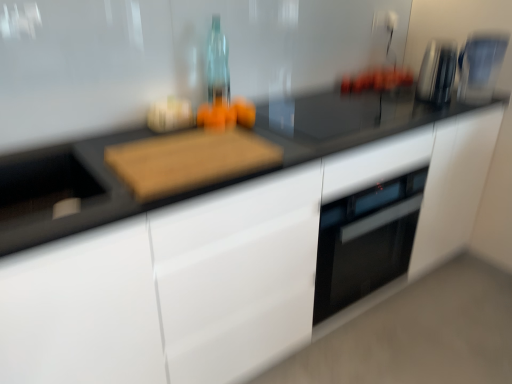
Question: Considering the relative sizes of orange matte oranges at center and satin silver toaster at upper right in the image provided, is orange matte oranges at center bigger than satin silver toaster at upper right?

Choices:
 (A) yes
 (B) no

Answer: (B)

Question: From a real-world perspective, is orange matte oranges at center beneath satin silver toaster at upper right?

Choices:
 (A) no
 (B) yes

Answer: (B)

Question: Is orange matte oranges at center thinner than satin silver toaster at upper right?

Choices:
 (A) yes
 (B) no

Answer: (A)

Question: Is the depth of orange matte oranges at center less than that of satin silver toaster at upper right?

Choices:
 (A) yes
 (B) no

Answer: (A)

Question: Does orange matte oranges at center have a greater height compared to satin silver toaster at upper right?

Choices:
 (A) no
 (B) yes

Answer: (A)

Question: Is orange matte oranges at center located outside satin silver toaster at upper right?

Choices:
 (A) no
 (B) yes

Answer: (B)

Question: Considering the relative sizes of wooden cutting board at center and sleek metallic coffee machine at upper right in the image provided, is wooden cutting board at center wider than sleek metallic coffee machine at upper right?

Choices:
 (A) yes
 (B) no

Answer: (A)

Question: From a real-world perspective, is wooden cutting board at center beneath sleek metallic coffee machine at upper right?

Choices:
 (A) no
 (B) yes

Answer: (B)

Question: Is the surface of wooden cutting board at center in direct contact with sleek metallic coffee machine at upper right?

Choices:
 (A) yes
 (B) no

Answer: (B)

Question: Does wooden cutting board at center lie in front of sleek metallic coffee machine at upper right?

Choices:
 (A) no
 (B) yes

Answer: (B)

Question: Is wooden cutting board at center oriented towards sleek metallic coffee machine at upper right?

Choices:
 (A) no
 (B) yes

Answer: (A)

Question: Considering the relative sizes of wooden cutting board at center and sleek metallic coffee machine at upper right in the image provided, is wooden cutting board at center thinner than sleek metallic coffee machine at upper right?

Choices:
 (A) yes
 (B) no

Answer: (B)

Question: Is satin silver toaster at upper right not within sleek metallic coffee machine at upper right?

Choices:
 (A) yes
 (B) no

Answer: (A)